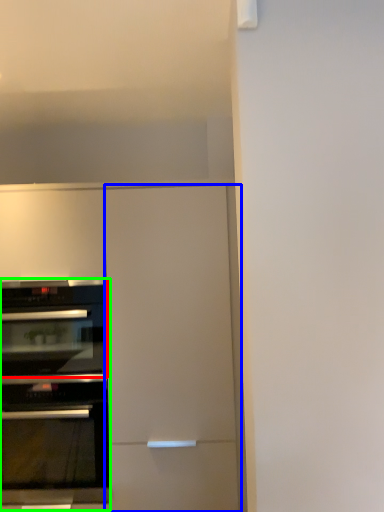
Question: Which object is positioned farthest from oven (highlighted by a red box)? Select from door (highlighted by a blue box) and oven (highlighted by a green box).

Choices:
 (A) door
 (B) oven

Answer: (A)